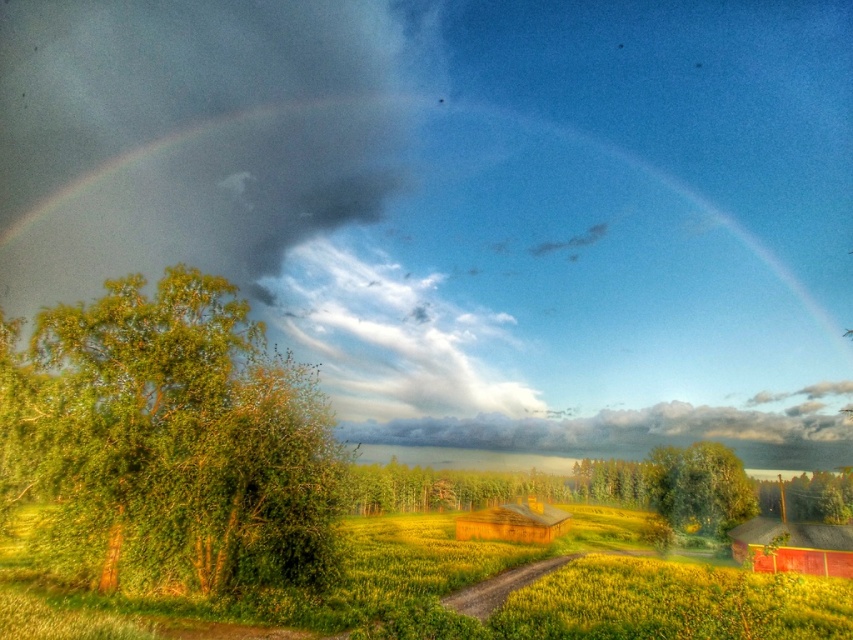
You are standing at the dirt path in the foreground and want to walk towards the wooden structure. Which direction should you go relative to the green leafy tree at left and the green grassy field at lower center?

You should walk towards the green grassy field at lower center, which is to the right of the green leafy tree at left, as the dirt path leads towards the wooden structure in that direction.

You are a landscape photographer planning to capture the entire green leafy tree at left and the green grassy field at lower center in one frame. Based on their sizes in the image, which object would you need to focus on to ensure both fit in the photo?

Since the green leafy tree at left occupies less space than the green grassy field at lower center, you should focus on the green grassy field at lower center to ensure both fit in the photo as it takes up more area in the scene.